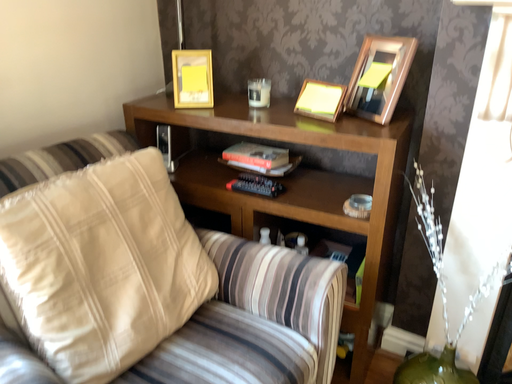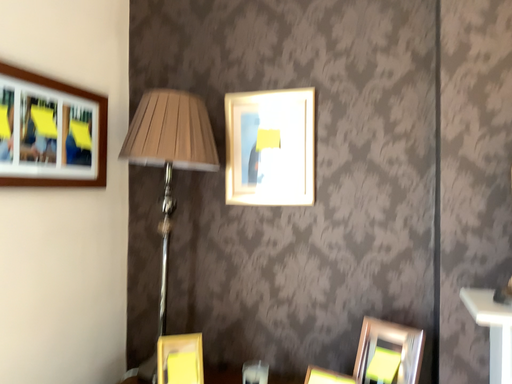
Question: Which way did the camera rotate in the video?

Choices:
 (A) rotated left
 (B) rotated right

Answer: (B)